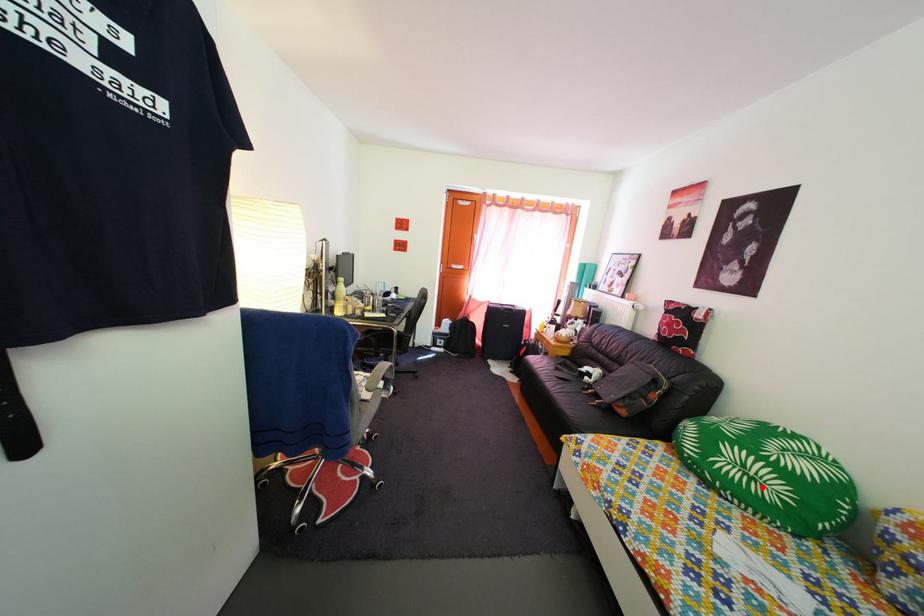
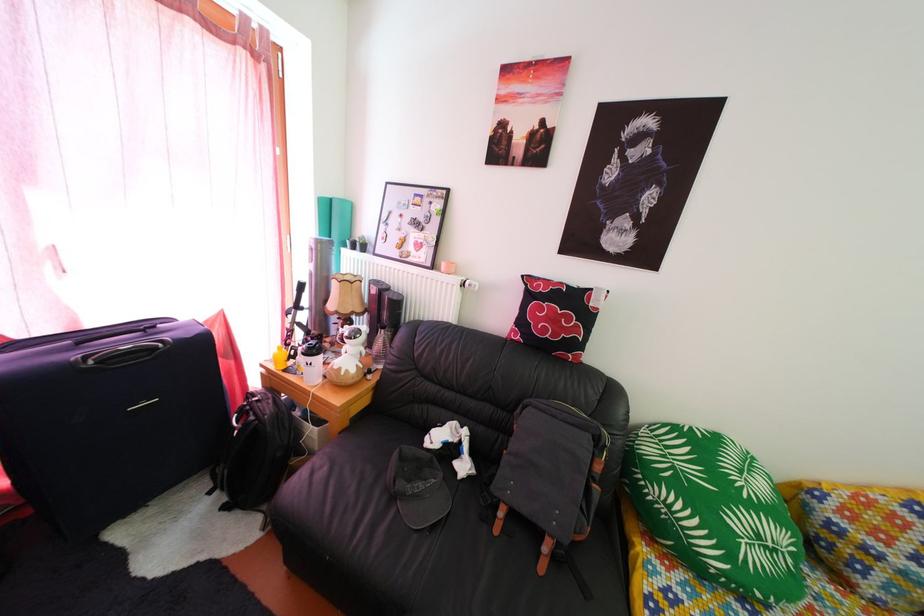
The point at the highlighted location is marked in the first image. Where is the corresponding point in the second image?

(784, 560)